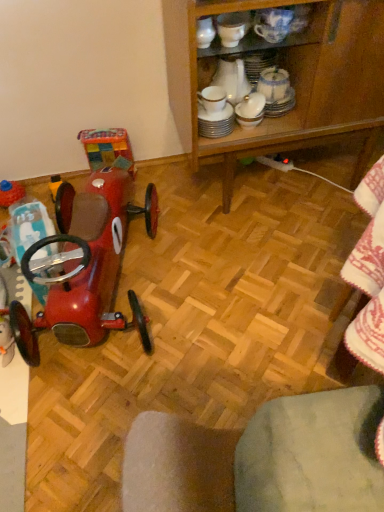
Identify the location of vacant area that is situated to the right of shiny red car at left, which is the first toy from front to back. This screenshot has width=384, height=512. (237, 287).